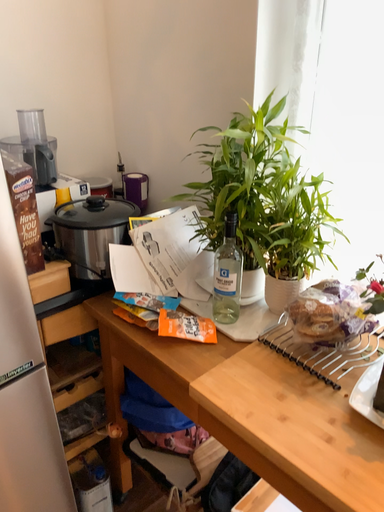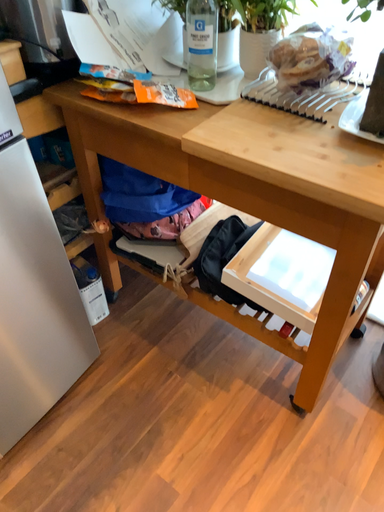
Question: How did the camera likely rotate when shooting the video?

Choices:
 (A) rotated left
 (B) rotated right

Answer: (B)